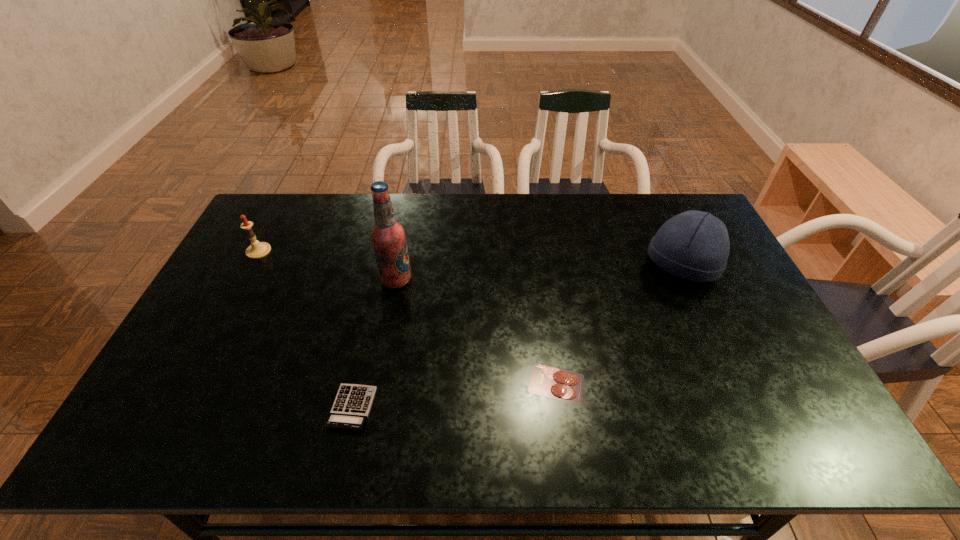
Locate an element on the screen. object that is the second closest one to the skullcap is located at coordinates (388, 236).

Locate an element on the screen. The height and width of the screenshot is (540, 960). blank area in the image that satisfies the following two spatial constraints: 1. on the front side of the candle; 2. on the left side of the tallest object is located at coordinates (244, 280).

The height and width of the screenshot is (540, 960). I want to click on vacant space that satisfies the following two spatial constraints: 1. on the back side of the fourth object from left to right; 2. on the right side of the second shortest object, so click(x=357, y=383).